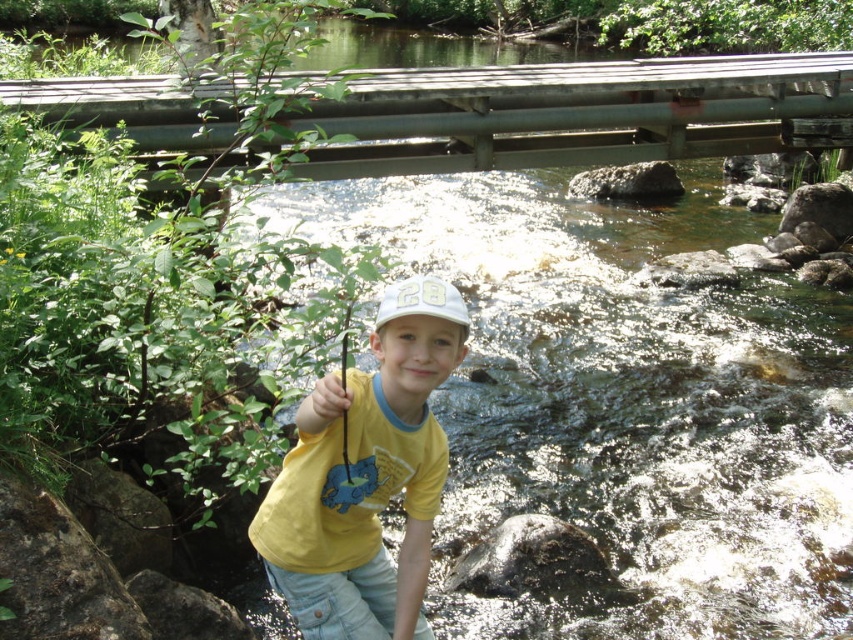
Can you confirm if wooden bridge at upper center is positioned to the left of yellow cotton shirt at center?

Correct, you'll find wooden bridge at upper center to the left of yellow cotton shirt at center.

Which is more to the left, wooden bridge at upper center or yellow cotton shirt at center?

wooden bridge at upper center is more to the left.

Locate an element on the screen. The width and height of the screenshot is (853, 640). wooden bridge at upper center is located at coordinates (579, 113).

Identify the location of wooden bridge at upper center. (579, 113).

At what (x,y) coordinates should I click in order to perform the action: click on yellow cotton shirt at center. Please return your answer as a coordinate pair (x, y). Looking at the image, I should click on (366, 477).

Can you confirm if yellow cotton shirt at center is positioned to the right of white matte baseball cap at center?

Incorrect, yellow cotton shirt at center is not on the right side of white matte baseball cap at center.

Which is behind, point (363, 634) or point (398, 292)?

Point (363, 634)

At what (x,y) coordinates should I click in order to perform the action: click on yellow cotton shirt at center. Please return your answer as a coordinate pair (x, y). This screenshot has height=640, width=853. Looking at the image, I should click on (366, 477).

Between point (637, 84) and point (409, 285), which one is positioned behind?

The point (637, 84) is more distant.

What do you see at coordinates (579, 113) in the screenshot? I see `wooden bridge at upper center` at bounding box center [579, 113].

The height and width of the screenshot is (640, 853). What are the coordinates of `wooden bridge at upper center` in the screenshot? It's located at (579, 113).